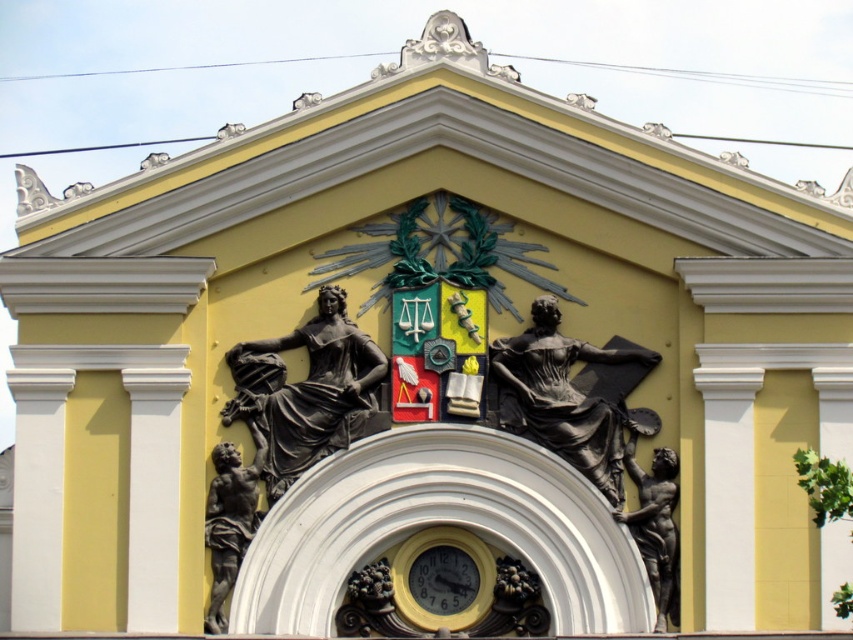
You are an architect reviewing the building facade. You notice two points marked on the design. The first point is at coordinate point (431,572) and the second is at point (227,548). Based on the design, which point is closer to the viewer?

Point (227,548) is closer to the viewer because the Objects Description states that point (431,572) is behind point (227,548).